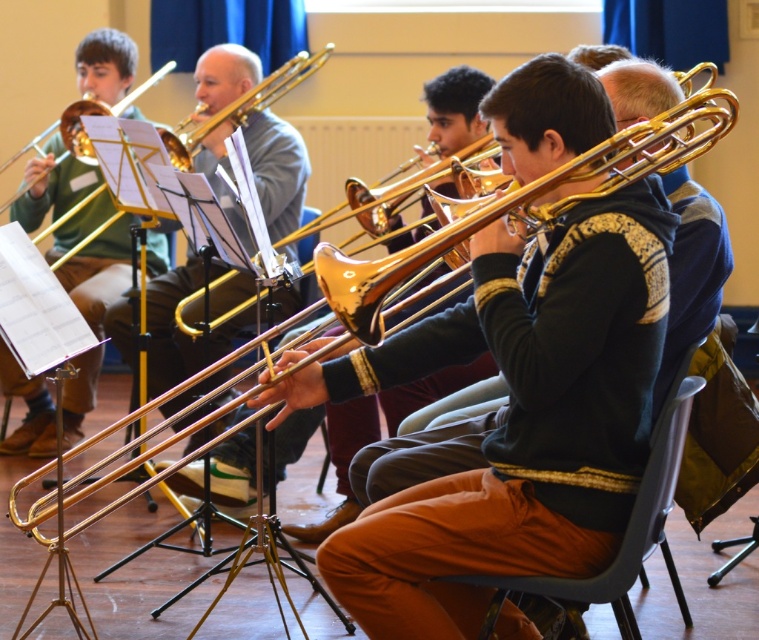
Image resolution: width=759 pixels, height=640 pixels. What do you see at coordinates (181, 330) in the screenshot?
I see `gold brass trombone at center` at bounding box center [181, 330].

Is gold brass trombone at center bigger than gold brass trumpet at upper left?

Indeed, gold brass trombone at center has a larger size compared to gold brass trumpet at upper left.

Is point (175, 403) farther from camera compared to point (96, 113)?

Yes, point (175, 403) is farther from viewer.

The height and width of the screenshot is (640, 759). I want to click on gold brass trombone at center, so click(181, 330).

The height and width of the screenshot is (640, 759). What do you see at coordinates (181, 330) in the screenshot? I see `gold brass trombone at center` at bounding box center [181, 330].

Which is behind, point (288, 205) or point (77, 118)?

Point (288, 205)

The height and width of the screenshot is (640, 759). What do you see at coordinates (181, 330) in the screenshot?
I see `gold brass trombone at center` at bounding box center [181, 330].

The image size is (759, 640). In order to click on gold brass trombone at center in this screenshot , I will do `click(181, 330)`.

Is gold brass trombone at center positioned in front of gold shiny trumpet at center?

No, gold brass trombone at center is behind gold shiny trumpet at center.

Between gold brass trombone at center and gold shiny trumpet at center, which one is positioned higher?

gold shiny trumpet at center is above.

What do you see at coordinates (181, 330) in the screenshot? This screenshot has width=759, height=640. I see `gold brass trombone at center` at bounding box center [181, 330].

You are a GUI agent. You are given a task and a screenshot of the screen. Output one action in this format:
    pyautogui.click(x=<x>, y=<y>)
    Task: Click on the gold brass trombone at center
    The height and width of the screenshot is (640, 759).
    Given the screenshot: What is the action you would take?
    pyautogui.click(x=181, y=330)